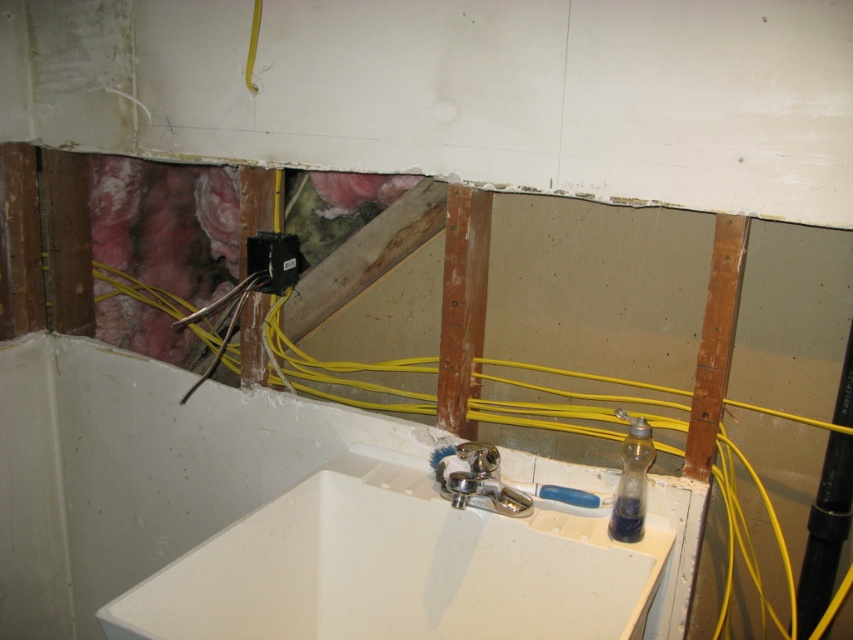
You are a contractor inspecting a bathroom under renovation. You see the white ceramic sink at center and the rusty wood beam at center. Which object is closer to the right side of the bathroom?

The rusty wood beam at center is closer to the right side of the bathroom because the white ceramic sink at center is positioned on its left side.

You are a contractor assessing the bathroom renovation. You need to place a 3ft wide tool box between the white ceramic sink at center and the rusty wood beam at center. Based on their widths, can the tool box fit in the space between them?

The white ceramic sink at center might be wider than rusty wood beam at center, so it is uncertain whether the 3ft wide tool box can fit between them without knowing the exact width difference.